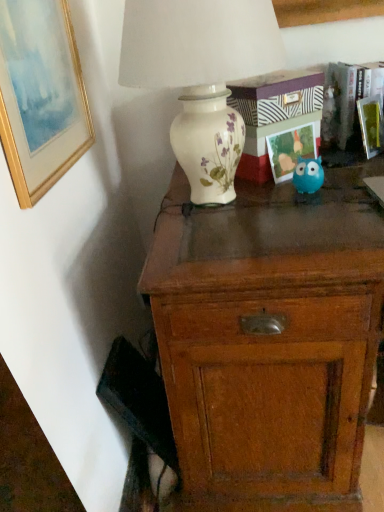
At what (x,y) coordinates should I click in order to perform the action: click on vacant area that lies in front of green matte picture frame at upper right, the third picture frame when ordered from left to right. Please return your answer as a coordinate pair (x, y). The width and height of the screenshot is (384, 512). Looking at the image, I should click on (362, 170).